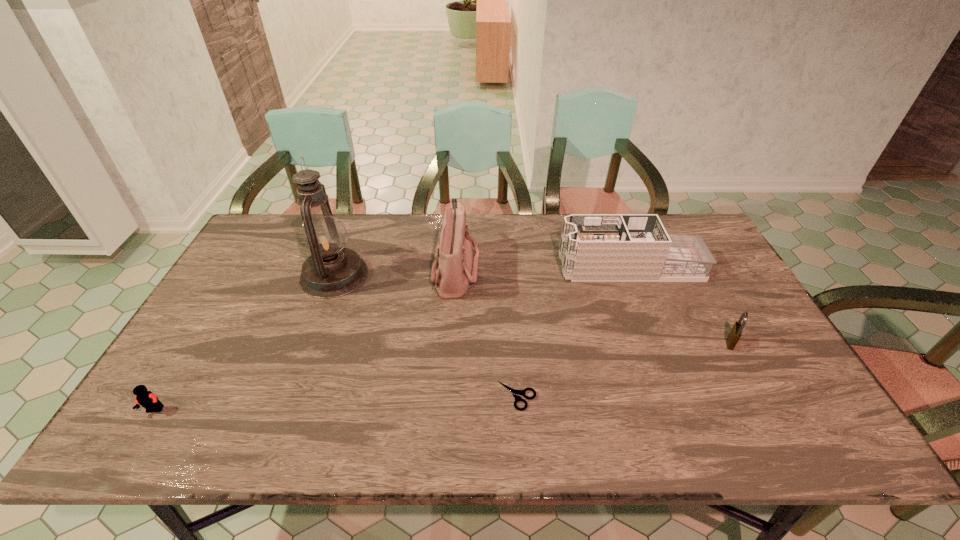
Image resolution: width=960 pixels, height=540 pixels. I want to click on empty location between the dollhouse and the fourth tallest object, so click(x=681, y=305).

Image resolution: width=960 pixels, height=540 pixels. What are the coordinates of `vacant area between the second object from left to right and the fourth shortest object` in the screenshot? It's located at (x=482, y=271).

Identify the location of free space that is in between the oil lamp and the shoulder bag. The height and width of the screenshot is (540, 960). (395, 272).

Choose which object is the fourth nearest neighbor to the third object from left to right. Please provide its 2D coordinates. Your answer should be formatted as a tuple, i.e. [(x, y)], where the tuple contains the x and y coordinates of a point satisfying the conditions above.

[(736, 331)]

Locate an element on the screen. The image size is (960, 540). object that stands as the fourth closest to the oil lamp is located at coordinates (594, 247).

The width and height of the screenshot is (960, 540). I want to click on free space that satisfies the following two spatial constraints: 1. at the entrance of the third tallest object; 2. on the right side of the fourth tallest object, so click(660, 342).

Identify the location of free space in the image that satisfies the following two spatial constraints: 1. at the entrance of the dollhouse; 2. on the front-facing side of the Lego. This screenshot has height=540, width=960. (685, 410).

The height and width of the screenshot is (540, 960). Find the location of `free location that satisfies the following two spatial constraints: 1. on the front pocket of the third object from left to right; 2. on the right side of the padlock`. free location that satisfies the following two spatial constraints: 1. on the front pocket of the third object from left to right; 2. on the right side of the padlock is located at coordinates (451, 342).

Find the location of a particular element. vacant point that satisfies the following two spatial constraints: 1. at the entrance of the fourth shortest object; 2. on the front-facing side of the second shortest object is located at coordinates (685, 410).

You are a GUI agent. You are given a task and a screenshot of the screen. Output one action in this format:
    pyautogui.click(x=<x>, y=<y>)
    Task: Click on the free space that satisfies the following two spatial constraints: 1. on the front pocket of the shoulder bag; 2. on the front-facing side of the leftmost object
    
    Given the screenshot: What is the action you would take?
    pyautogui.click(x=446, y=410)